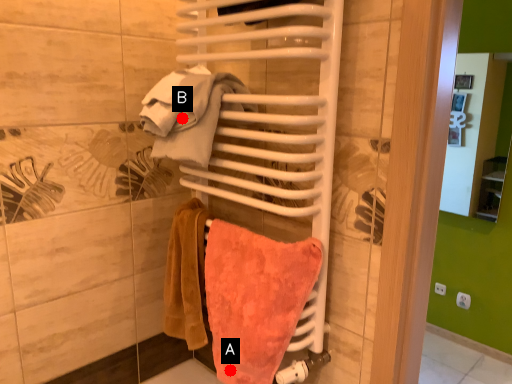
Question: Two points are circled on the image, labeled by A and B beside each circle. Which point is farther to the camera?

Choices:
 (A) A is further
 (B) B is further

Answer: (A)